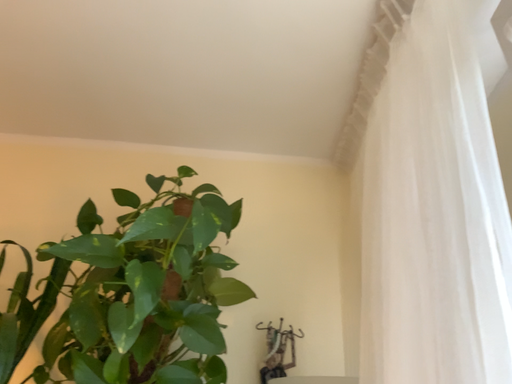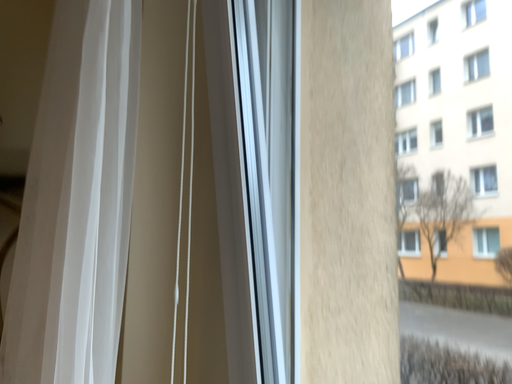
Question: Which way did the camera rotate in the video?

Choices:
 (A) rotated downward
 (B) rotated upward

Answer: (A)